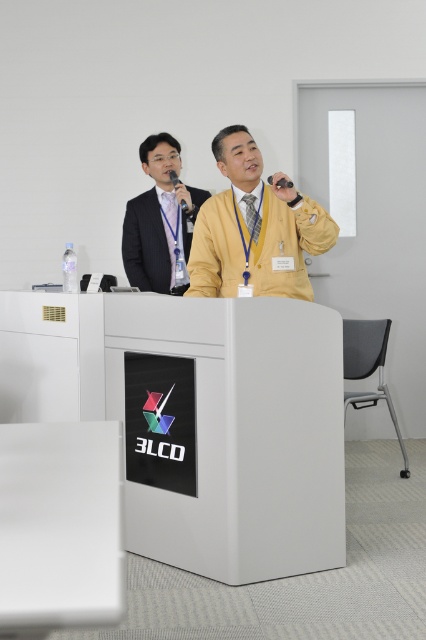
Can you confirm if white matte table at center is positioned above matte black suit at upper left?

No.

Can you confirm if white matte table at center is smaller than matte black suit at upper left?

No, white matte table at center is not smaller than matte black suit at upper left.

Which is in front, point (278, 472) or point (164, 170)?

Positioned in front is point (278, 472).

Identify the location of white matte table at center. (204, 419).

Describe the element at coordinates (160, 220) in the screenshot. Image resolution: width=426 pixels, height=640 pixels. I see `matte black suit at upper left` at that location.

In the scene shown: Which is above, matte black suit at upper left or black matte microphone at upper center?

Positioned higher is matte black suit at upper left.

I want to click on matte black suit at upper left, so click(x=160, y=220).

In order to click on matte black suit at upper left in this screenshot , I will do `click(160, 220)`.

Does matte black microphone at upper center lie behind black matte microphone at upper center?

Yes, it is.

Which is in front, point (187, 205) or point (282, 180)?

Point (282, 180) is more forward.

Measure the distance between matte black microphone at upper center and camera.

matte black microphone at upper center and camera are 4.17 meters apart from each other.

Identify the location of matte black microphone at upper center. (173, 177).